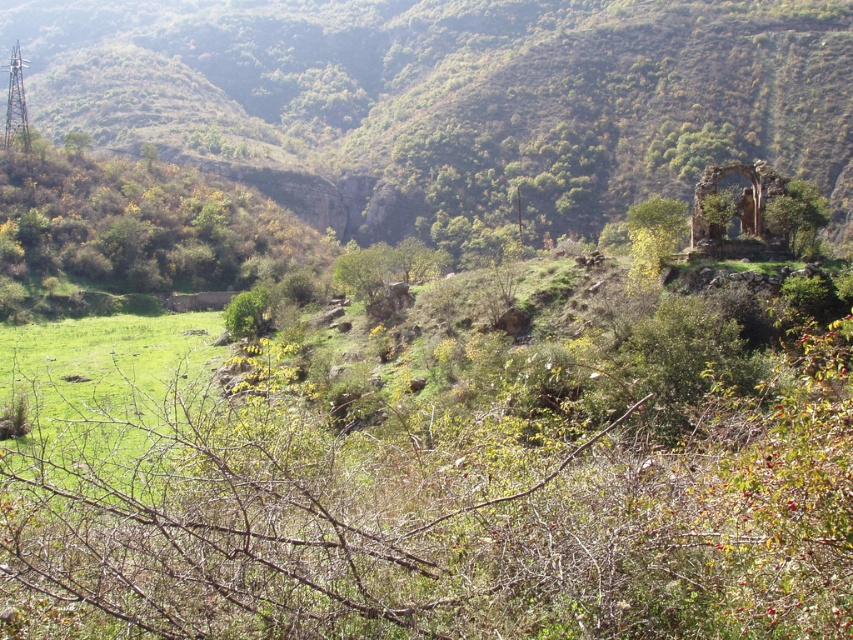
Is point (764, 67) more distant than point (85, 180)?

Yes, point (764, 67) is behind point (85, 180).

Who is positioned more to the left, green grassy hillside at center or green leafy shrub at left?

green grassy hillside at center is more to the left.

Locate an element on the screen. The height and width of the screenshot is (640, 853). green grassy hillside at center is located at coordinates (451, 97).

Is green leafy tree at upper right smaller than green leafy tree at center-right?

No, green leafy tree at upper right is not smaller than green leafy tree at center-right.

Between green leafy tree at upper right and green leafy tree at center-right, which one has more height?

green leafy tree at upper right is taller.

Measure the distance between point (799, 237) and camera.

Point (799, 237) and camera are 198.21 feet apart from each other.

Identify the location of green leafy tree at upper right. (798, 216).

How much distance is there between green leafy shrub at left and green leafy tree at center-right?

green leafy shrub at left is 398.47 feet away from green leafy tree at center-right.

Can you confirm if green leafy shrub at left is thinner than green leafy tree at center-right?

Incorrect, green leafy shrub at left's width is not less than green leafy tree at center-right's.

This screenshot has width=853, height=640. Describe the element at coordinates (142, 225) in the screenshot. I see `green leafy shrub at left` at that location.

The width and height of the screenshot is (853, 640). I want to click on green leafy shrub at left, so click(142, 225).